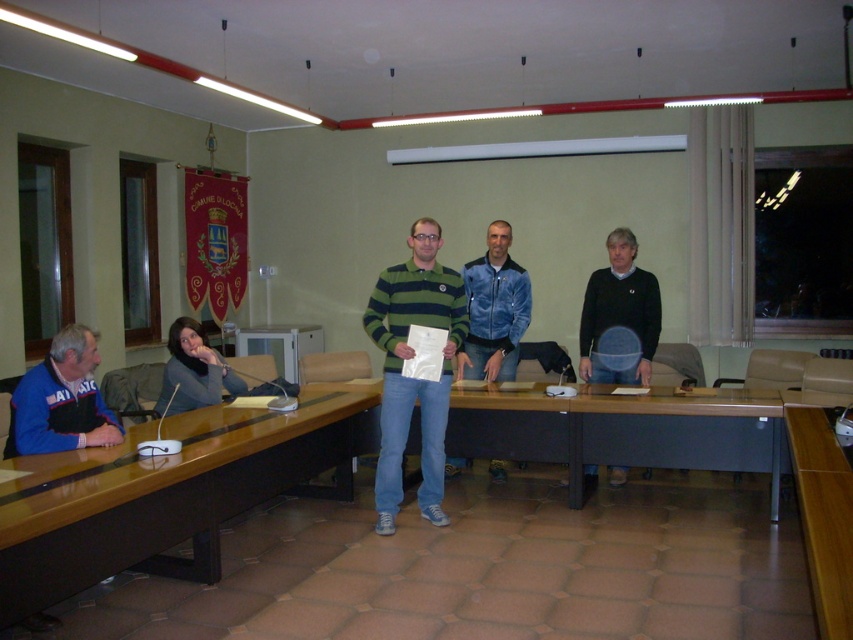
Consider the image. Is black sweater at center thinner than matte gray sweater at lower left?

Yes.

Is black sweater at center wider than matte gray sweater at lower left?

Incorrect, black sweater at center's width does not surpass matte gray sweater at lower left's.

Identify the location of black sweater at center. (619, 310).

At what (x,y) coordinates should I click in order to perform the action: click on black sweater at center. Please return your answer as a coordinate pair (x, y). Looking at the image, I should click on (619, 310).

Can you confirm if black matte table at center is positioned to the left of blue fleece jacket at left?

In fact, black matte table at center is to the right of blue fleece jacket at left.

Does point (675, 410) come in front of point (96, 397)?

No.

You are a GUI agent. You are given a task and a screenshot of the screen. Output one action in this format:
    pyautogui.click(x=<x>, y=<y>)
    Task: Click on the black matte table at center
    This screenshot has width=853, height=640.
    Given the screenshot: What is the action you would take?
    tap(677, 433)

Is green striped polo shirt at center positioned in front of brown wooden table at lower right?

No, green striped polo shirt at center is behind brown wooden table at lower right.

The image size is (853, 640). Describe the element at coordinates (415, 378) in the screenshot. I see `green striped polo shirt at center` at that location.

Between point (431, 394) and point (843, 490), which one is positioned behind?

Point (431, 394)

Locate an element on the screen. The width and height of the screenshot is (853, 640). green striped polo shirt at center is located at coordinates (415, 378).